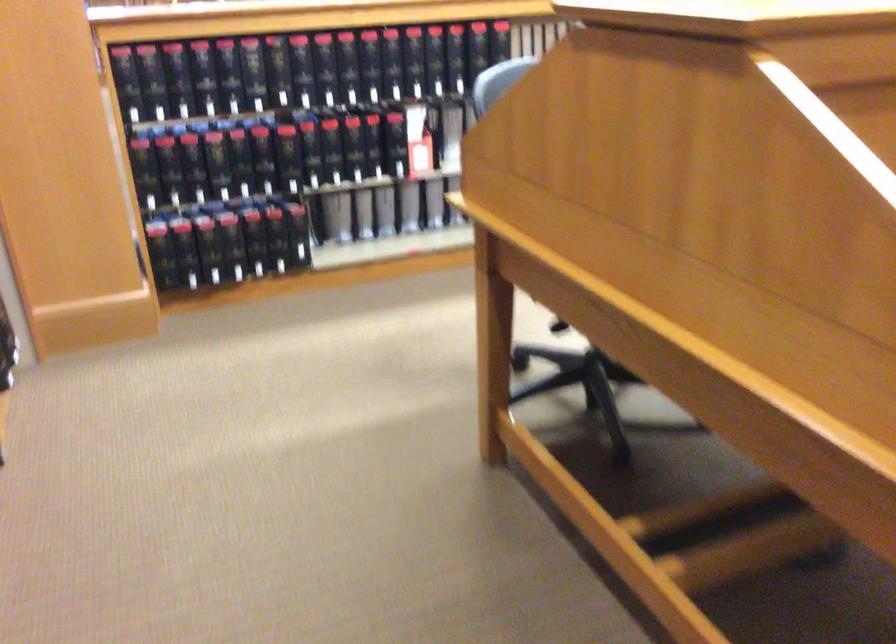
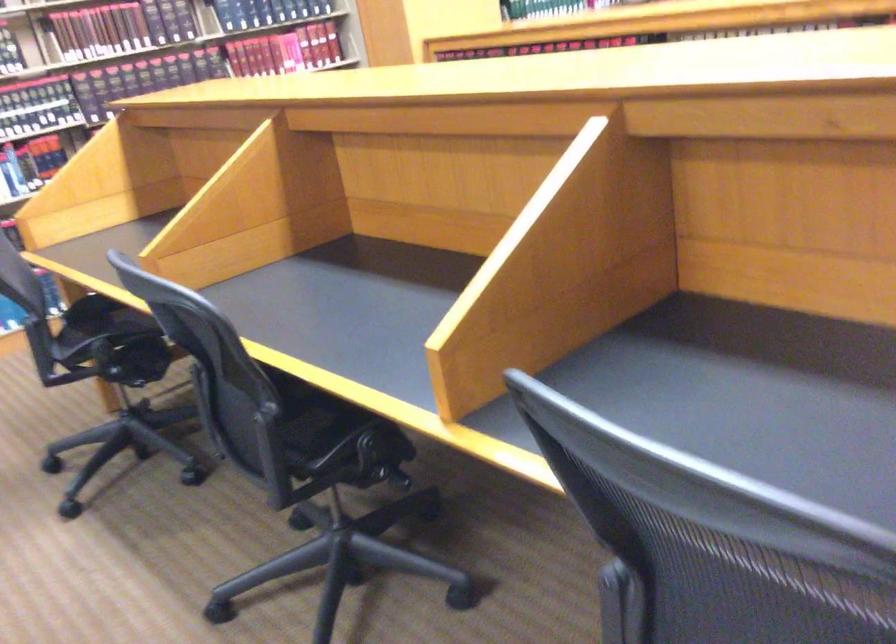
Question: I am providing you with two images of the same scene from different viewpoints. After the viewpoint changes to image2, which objects are now occluded?

Choices:
 (A) red gaming controller
 (B) hardcover book
 (C) black binder book
 (D) chair sitting surface

Answer: (C)